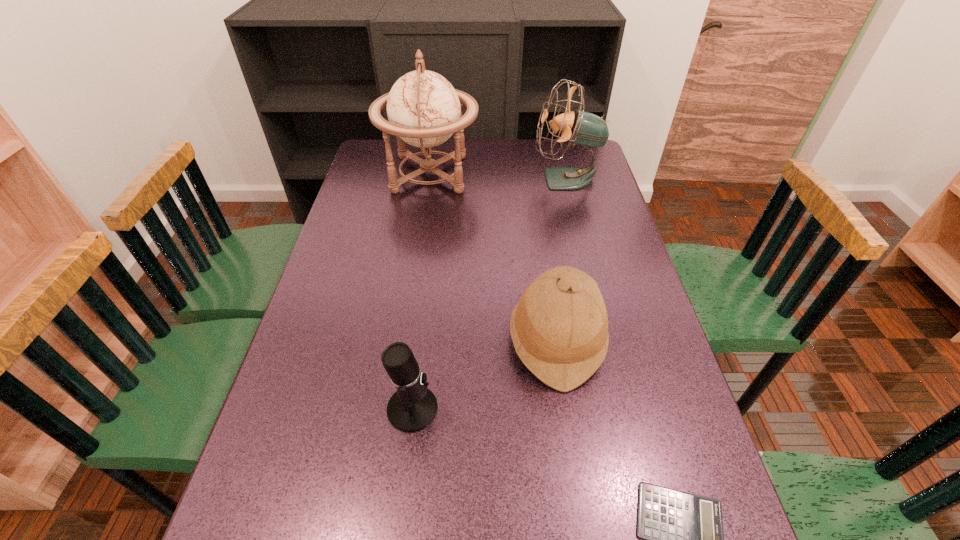
What are the coordinates of `free space located 0.310m on the front-facing side of the hat` in the screenshot? It's located at point(380,340).

You are a GUI agent. You are given a task and a screenshot of the screen. Output one action in this format:
    pyautogui.click(x=<x>, y=<y>)
    Task: Click on the vacant space located 0.230m on the back of the fourth tallest object
    Image resolution: width=960 pixels, height=540 pixels.
    Given the screenshot: What is the action you would take?
    (x=424, y=308)

Locate an element on the screen. globe that is at the far edge is located at coordinates (424, 110).

In order to click on fan that is at the far edge in this screenshot , I will do `click(580, 127)`.

The width and height of the screenshot is (960, 540). What are the coordinates of `object that is at the left edge` in the screenshot? It's located at (424, 110).

The width and height of the screenshot is (960, 540). I want to click on fan at the right edge, so click(x=580, y=127).

This screenshot has width=960, height=540. I want to click on hat that is at the right edge, so click(559, 329).

This screenshot has height=540, width=960. In order to click on object present at the far left corner in this screenshot , I will do `click(424, 110)`.

I want to click on object at the far right corner, so click(580, 127).

The image size is (960, 540). I want to click on free location at the far edge, so click(514, 147).